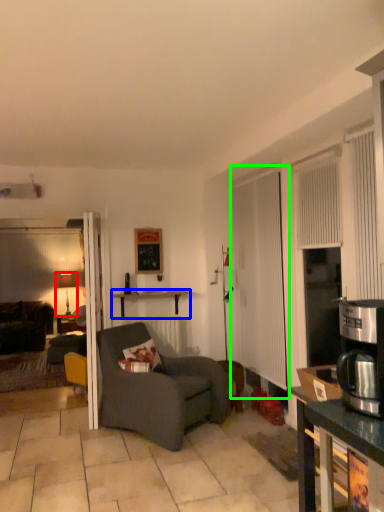
Question: Which object is positioned closest to lamp (highlighted by a red box)? Select from desk (highlighted by a blue box) and screen door (highlighted by a green box).

Choices:
 (A) desk
 (B) screen door

Answer: (A)